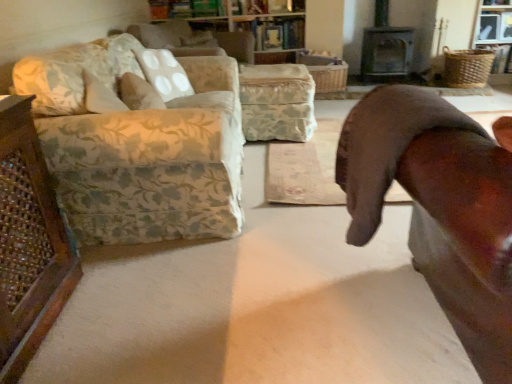
Question: From the image's perspective, is brown leather chair at right on top of floral fabric couch at left?

Choices:
 (A) no
 (B) yes

Answer: (A)

Question: Is brown leather chair at right bigger than floral fabric couch at left?

Choices:
 (A) yes
 (B) no

Answer: (B)

Question: Is brown leather chair at right oriented away from floral fabric couch at left?

Choices:
 (A) yes
 (B) no

Answer: (B)

Question: Can you confirm if brown leather chair at right is taller than floral fabric couch at left?

Choices:
 (A) no
 (B) yes

Answer: (B)

Question: Does brown leather chair at right turn towards floral fabric couch at left?

Choices:
 (A) no
 (B) yes

Answer: (A)

Question: Is point (166, 6) positioned closer to the camera than point (214, 46)?

Choices:
 (A) farther
 (B) closer

Answer: (A)

Question: Is wooden bookshelf at upper center spatially inside white dotted fabric pillow at upper center, marked as the 2th pillow in a bottom-to-top arrangement, or outside of it?

Choices:
 (A) outside
 (B) inside

Answer: (A)

Question: In the image, is wooden bookshelf at upper center positioned in front of or behind white dotted fabric pillow at upper center, marked as the 2th pillow in a bottom-to-top arrangement?

Choices:
 (A) behind
 (B) front

Answer: (A)

Question: Looking at the image, does wooden bookshelf at upper center seem bigger or smaller compared to white dotted fabric pillow at upper center, marked as the 2th pillow in a bottom-to-top arrangement?

Choices:
 (A) small
 (B) big

Answer: (B)

Question: From the image's perspective, is metallic gray fireplace at upper right located above or below white dotted fabric pillow at upper center, the first pillow viewed from the top?

Choices:
 (A) below
 (B) above

Answer: (B)

Question: Considering the positions of metallic gray fireplace at upper right and white dotted fabric pillow at upper center, marked as the 2th pillow in a bottom-to-top arrangement, in the image, is metallic gray fireplace at upper right bigger or smaller than white dotted fabric pillow at upper center, marked as the 2th pillow in a bottom-to-top arrangement,?

Choices:
 (A) big
 (B) small

Answer: (A)

Question: Considering the positions of metallic gray fireplace at upper right and white dotted fabric pillow at upper center, marked as the 2th pillow in a bottom-to-top arrangement, in the image, is metallic gray fireplace at upper right wider or thinner than white dotted fabric pillow at upper center, marked as the 2th pillow in a bottom-to-top arrangement,?

Choices:
 (A) thin
 (B) wide

Answer: (B)

Question: Relative to white dotted fabric pillow at upper center, the first pillow positioned from the back, is metallic gray fireplace at upper right in front or behind?

Choices:
 (A) behind
 (B) front

Answer: (A)

Question: Is floral fabric pillow at upper left, positioned as the 2th pillow in top-to-bottom order, to the left or to the right of floral fabric couch at left in the image?

Choices:
 (A) left
 (B) right

Answer: (A)

Question: Is point (132, 96) closer or farther from the camera than point (129, 142)?

Choices:
 (A) farther
 (B) closer

Answer: (A)